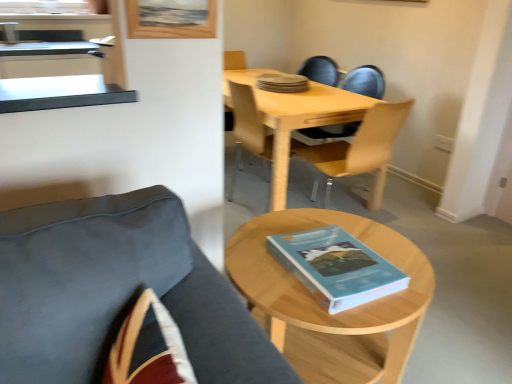
Identify the location of blue matte book at center, which is the 2th book from front to back. (282, 83).

What do you see at coordinates (117, 291) in the screenshot? The height and width of the screenshot is (384, 512). I see `velvet dark blue chair at lower left, the 3th chair positioned from the back` at bounding box center [117, 291].

This screenshot has width=512, height=384. Describe the element at coordinates (285, 118) in the screenshot. I see `light wood/wooden table at center` at that location.

Measure the distance between light wood/wooden table at center and camera.

A distance of 2.29 meters exists between light wood/wooden table at center and camera.

Image resolution: width=512 pixels, height=384 pixels. Describe the element at coordinates (336, 267) in the screenshot. I see `blue matte book at center, which ranks as the second book in top-to-bottom order` at that location.

Describe the element at coordinates (170, 18) in the screenshot. I see `wooden picture frame at upper center` at that location.

Locate an element on the screen. This screenshot has height=384, width=512. light wood/transparent plastic chair at center, positioned as the third chair in front-to-back order is located at coordinates (249, 124).

Does blue matte book at center, marked as the 1th book in a bottom-to-top arrangement, touch light wood/woodenobject at lower right?

blue matte book at center, marked as the 1th book in a bottom-to-top arrangement, and light wood/woodenobject at lower right are clearly separated.

Is blue matte book at center, marked as the 1th book in a bottom-to-top arrangement, positioned beyond the bounds of light wood/woodenobject at lower right?

Indeed, blue matte book at center, marked as the 1th book in a bottom-to-top arrangement, is completely outside light wood/woodenobject at lower right.

Between blue matte book at center, marked as the 1th book in a bottom-to-top arrangement, and light wood/woodenobject at lower right, which one has less height?

blue matte book at center, marked as the 1th book in a bottom-to-top arrangement, is shorter.

Relative to light wood/woodenobject at lower right, is blue matte book at center, marked as the 1th book in a bottom-to-top arrangement, in front or behind?

Visually, blue matte book at center, marked as the 1th book in a bottom-to-top arrangement, is located behind light wood/woodenobject at lower right.

Does velvet dark blue chair at lower left, placed as the first chair when sorted from front to back, turn towards blue matte book at center, which ranks as the second book in back-to-front order?

No, velvet dark blue chair at lower left, placed as the first chair when sorted from front to back, is not facing towards blue matte book at center, which ranks as the second book in back-to-front order.

From a real-world perspective, is velvet dark blue chair at lower left, the 3th chair positioned from the back, below blue matte book at center, marked as the 1th book in a bottom-to-top arrangement?

Yes.

Can you confirm if velvet dark blue chair at lower left, placed as the first chair when sorted from front to back, is thinner than blue matte book at center, which ranks as the second book in top-to-bottom order?

Yes.

From the velvet dark blue chair at lower left, placed as the first chair when sorted from front to back, count 1st books backward and point to it. Please provide its 2D coordinates.

[(336, 267)]

Are blue matte book at center, which ranks as the first book in top-to-bottom order, and light wood/transparent plastic chair at center, the first chair in the back-to-front sequence, far apart?

No, there isn't a large distance between blue matte book at center, which ranks as the first book in top-to-bottom order, and light wood/transparent plastic chair at center, the first chair in the back-to-front sequence.

Is blue matte book at center, which is the first book from back to front, facing towards light wood/transparent plastic chair at center, positioned as the third chair in front-to-back order?

No, blue matte book at center, which is the first book from back to front, does not turn towards light wood/transparent plastic chair at center, positioned as the third chair in front-to-back order.

From a real-world perspective, who is located lower, blue matte book at center, which is the 2th book from front to back, or light wood/transparent plastic chair at center, positioned as the third chair in front-to-back order?

light wood/transparent plastic chair at center, positioned as the third chair in front-to-back order.

Consider the image. From a real-world perspective, between light wood/wooden table at center and blue matte book at center, marked as the 1th book in a bottom-to-top arrangement, who is vertically lower?

From a 3D spatial view, light wood/wooden table at center is below.

You are a GUI agent. You are given a task and a screenshot of the screen. Output one action in this format:
    pyautogui.click(x=<x>, y=<y>)
    Task: Click on the desk below the blue matte book at center, which ranks as the second book in back-to-front order (from a real-world perspective)
    The image size is (512, 384).
    Given the screenshot: What is the action you would take?
    pyautogui.click(x=285, y=118)

From the image's perspective, is light wood/wooden table at center under blue matte book at center, the 1th book positioned from the front?

No, from the image's perspective, light wood/wooden table at center is not beneath blue matte book at center, the 1th book positioned from the front.

From the picture: Considering the positions of objects light wood/wooden table at center and blue matte book at center, which ranks as the second book in top-to-bottom order, in the image provided, who is in front, light wood/wooden table at center or blue matte book at center, which ranks as the second book in top-to-bottom order,?

blue matte book at center, which ranks as the second book in top-to-bottom order.

Considering the positions of objects light wood/transparent plastic chair at center, the first chair in the back-to-front sequence, and blue matte book at center, which is the first book from back to front, in the image provided, who is more to the right, light wood/transparent plastic chair at center, the first chair in the back-to-front sequence, or blue matte book at center, which is the first book from back to front,?

blue matte book at center, which is the first book from back to front.

From the image's perspective, is light wood/transparent plastic chair at center, the first chair in the back-to-front sequence, positioned above or below blue matte book at center, which is the 2th book from front to back?

Clearly, from the image's perspective, light wood/transparent plastic chair at center, the first chair in the back-to-front sequence, is below blue matte book at center, which is the 2th book from front to back.

In the scene shown: Considering the sizes of objects light wood/transparent plastic chair at center, positioned as the third chair in front-to-back order, and blue matte book at center, the 2th book when ordered from bottom to top, in the image provided, who is smaller, light wood/transparent plastic chair at center, positioned as the third chair in front-to-back order, or blue matte book at center, the 2th book when ordered from bottom to top,?

blue matte book at center, the 2th book when ordered from bottom to top.

There is a blue matte book at center, which ranks as the first book in top-to-bottom order. Where is `the 1st chair below it (from the image's perspective)`? The width and height of the screenshot is (512, 384). the 1st chair below it (from the image's perspective) is located at coordinates (249, 124).

Is point (378, 188) behind point (177, 21)?

Yes, point (378, 188) is farther from viewer.

Which object is further away from the camera, light wood/wooden chair at center, the 2th chair viewed from the back, or wooden picture frame at upper center?

light wood/wooden chair at center, the 2th chair viewed from the back, is behind.

Is light wood/wooden chair at center, the 2th chair viewed from the back, positioned beyond the bounds of wooden picture frame at upper center?

Absolutely, light wood/wooden chair at center, the 2th chair viewed from the back, is external to wooden picture frame at upper center.

Between light wood/wooden chair at center, the 2th chair viewed from the front, and wooden picture frame at upper center, which one has more height?

Standing taller between the two is light wood/wooden chair at center, the 2th chair viewed from the front.

From the image's perspective, is light wood/transparent plastic chair at center, the first chair in the back-to-front sequence, positioned above or below velvet dark blue chair at lower left, placed as the first chair when sorted from front to back?

From the image's perspective, light wood/transparent plastic chair at center, the first chair in the back-to-front sequence, appears above velvet dark blue chair at lower left, placed as the first chair when sorted from front to back.

Does light wood/transparent plastic chair at center, positioned as the third chair in front-to-back order, have a larger size compared to velvet dark blue chair at lower left, placed as the first chair when sorted from front to back?

Yes, light wood/transparent plastic chair at center, positioned as the third chair in front-to-back order, is bigger than velvet dark blue chair at lower left, placed as the first chair when sorted from front to back.

Could velvet dark blue chair at lower left, the 3th chair positioned from the back, be considered to be inside light wood/transparent plastic chair at center, positioned as the third chair in front-to-back order?

No, velvet dark blue chair at lower left, the 3th chair positioned from the back, is located outside of light wood/transparent plastic chair at center, positioned as the third chair in front-to-back order.

Consider the image. Considering the relative sizes of light wood/transparent plastic chair at center, the first chair in the back-to-front sequence, and velvet dark blue chair at lower left, placed as the first chair when sorted from front to back, in the image provided, is light wood/transparent plastic chair at center, the first chair in the back-to-front sequence, thinner than velvet dark blue chair at lower left, placed as the first chair when sorted from front to back,?

Incorrect, the width of light wood/transparent plastic chair at center, the first chair in the back-to-front sequence, is not less than that of velvet dark blue chair at lower left, placed as the first chair when sorted from front to back.

Find the location of a particular element. book that appears on the right of light wood/woodenobject at lower right is located at coordinates (336, 267).

There is a blue matte book at center, which ranks as the second book in back-to-front order. What are the coordinates of `the 2nd chair below it (from a real-world perspective)` in the screenshot? It's located at (117, 291).

When comparing their distances from wooden picture frame at upper center, does velvet dark blue chair at lower left, the 3th chair positioned from the back, or blue matte book at center, marked as the 1th book in a bottom-to-top arrangement, seem further?

Based on the image, blue matte book at center, marked as the 1th book in a bottom-to-top arrangement, appears to be further to wooden picture frame at upper center.

Estimate the real-world distances between objects in this image. Which object is closer to blue matte book at center, which is the first book from back to front, light wood/woodenobject at lower right or light wood/wooden chair at center, the 2th chair viewed from the front?

Based on the image, light wood/wooden chair at center, the 2th chair viewed from the front, appears to be nearer to blue matte book at center, which is the first book from back to front.

From the image, which object appears to be nearer to blue matte book at center, which is the 2th book from front to back, light wood/transparent plastic chair at center, positioned as the third chair in front-to-back order, or light wood/wooden table at center?

light wood/wooden table at center is closer to blue matte book at center, which is the 2th book from front to back.

Looking at this image, which object lies further to the anchor point blue matte book at center, the 2th book when ordered from bottom to top, light wood/woodenobject at lower right or wooden picture frame at upper center?

light wood/woodenobject at lower right lies further to blue matte book at center, the 2th book when ordered from bottom to top, than the other object.

Which object lies further to the anchor point light wood/wooden table at center, wooden picture frame at upper center or blue matte book at center, which ranks as the second book in top-to-bottom order?

blue matte book at center, which ranks as the second book in top-to-bottom order, is positioned further to the anchor light wood/wooden table at center.

Based on their spatial positions, is light wood/woodenobject at lower right or light wood/transparent plastic chair at center, the first chair in the back-to-front sequence, further from blue matte book at center, marked as the 1th book in a bottom-to-top arrangement?

Based on the image, light wood/transparent plastic chair at center, the first chair in the back-to-front sequence, appears to be further to blue matte book at center, marked as the 1th book in a bottom-to-top arrangement.

Looking at the image, which one is located closer to light wood/wooden chair at center, the 2th chair viewed from the back, blue matte book at center, the 1th book positioned from the front, or wooden picture frame at upper center?

Based on the image, blue matte book at center, the 1th book positioned from the front, appears to be nearer to light wood/wooden chair at center, the 2th chair viewed from the back.

Estimate the real-world distances between objects in this image. Which object is closer to light wood/wooden table at center, light wood/transparent plastic chair at center, the first chair in the back-to-front sequence, or light wood/woodenobject at lower right?

light wood/transparent plastic chair at center, the first chair in the back-to-front sequence, is closer to light wood/wooden table at center.

Locate an element on the screen. Image resolution: width=512 pixels, height=384 pixels. book located between velvet dark blue chair at lower left, placed as the first chair when sorted from front to back, and light wood/wooden table at center in the depth direction is located at coordinates point(336,267).

In order to click on coffee table positioned between velvet dark blue chair at lower left, placed as the first chair when sorted from front to back, and blue matte book at center, which is the first book from back to front, from near to far in this screenshot , I will do `click(324, 310)`.

Locate an element on the screen. The image size is (512, 384). coffee table between velvet dark blue chair at lower left, placed as the first chair when sorted from front to back, and light wood/transparent plastic chair at center, the first chair in the back-to-front sequence, in the front-back direction is located at coordinates (324, 310).

Image resolution: width=512 pixels, height=384 pixels. What are the coordinates of `book between light wood/woodenobject at lower right and blue matte book at center, which is the first book from back to front, along the z-axis` in the screenshot? It's located at (336, 267).